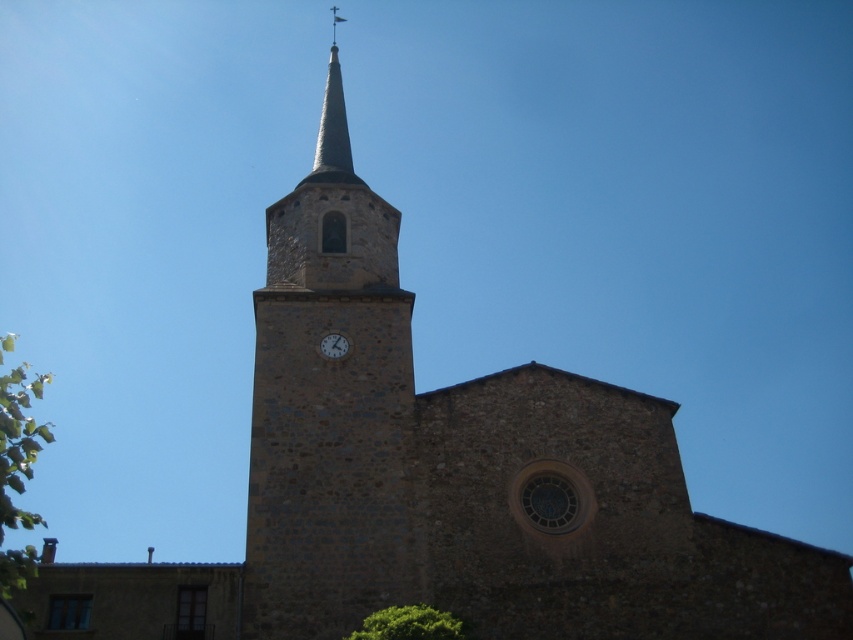
Which is above, stone clock tower at center or green leafy tree at lower left?

stone clock tower at center

Measure the distance between stone clock tower at center and camera.

stone clock tower at center and camera are 136.80 feet apart from each other.

Locate an element on the screen. This screenshot has height=640, width=853. stone clock tower at center is located at coordinates (328, 404).

Between green leafy tree at lower left and green leafy tree at lower center, which one has less height?

green leafy tree at lower center is shorter.

Does green leafy tree at lower left have a smaller size compared to green leafy tree at lower center?

Actually, green leafy tree at lower left might be larger than green leafy tree at lower center.

Locate an element on the screen. green leafy tree at lower left is located at coordinates (18, 467).

Where is `green leafy tree at lower left`? This screenshot has height=640, width=853. green leafy tree at lower left is located at coordinates (18, 467).

Where is `stone clock tower at center`? This screenshot has width=853, height=640. stone clock tower at center is located at coordinates (328, 404).

Is stone clock tower at center positioned at the back of smooth gray steeple at upper center?

No.

Describe the element at coordinates (328, 404) in the screenshot. This screenshot has height=640, width=853. I see `stone clock tower at center` at that location.

The image size is (853, 640). What are the coordinates of `stone clock tower at center` in the screenshot? It's located at (328, 404).